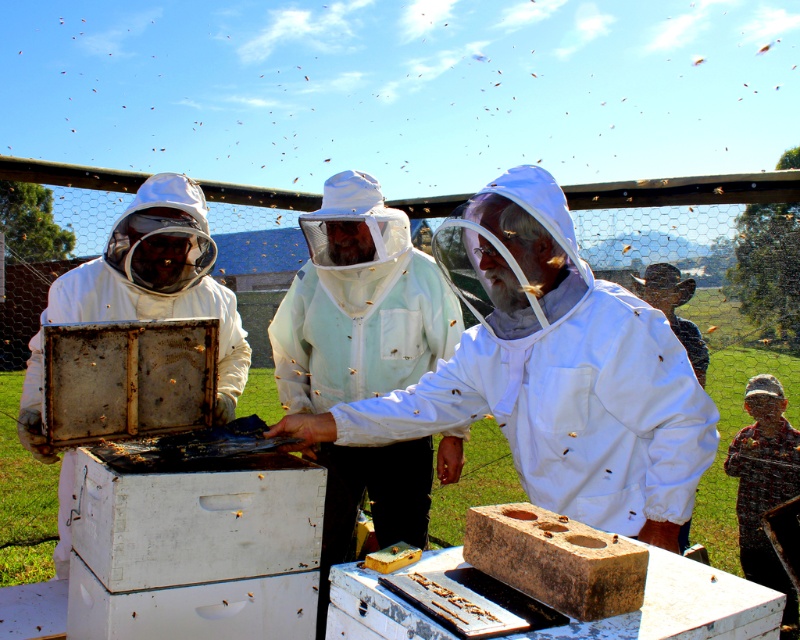
Question: Does white fabric beekeeper at center have a larger size compared to camouflage-patterned shirt at lower right?

Choices:
 (A) yes
 (B) no

Answer: (B)

Question: Is white matte beekeeper suit at left thinner than rusty metal beehive at center?

Choices:
 (A) yes
 (B) no

Answer: (B)

Question: Based on their relative distances, which object is farther from the brown textured block at center?

Choices:
 (A) camouflage-patterned shirt at lower right
 (B) white matte beekeeper suit at left
 (C) rusty metal beehive at center
 (D) white fabric beekeeper at center

Answer: (A)

Question: Which point is closer to the camera taking this photo?

Choices:
 (A) (562, 593)
 (B) (69, 355)
 (C) (154, 198)
 (D) (770, 504)

Answer: (A)

Question: Which point is farther to the camera?

Choices:
 (A) white matte beekeeper suit at left
 (B) brown textured block at center
 (C) camouflage-patterned shirt at lower right

Answer: (C)

Question: Does rusty metal beehive at center have a greater width compared to brown textured block at center?

Choices:
 (A) yes
 (B) no

Answer: (A)